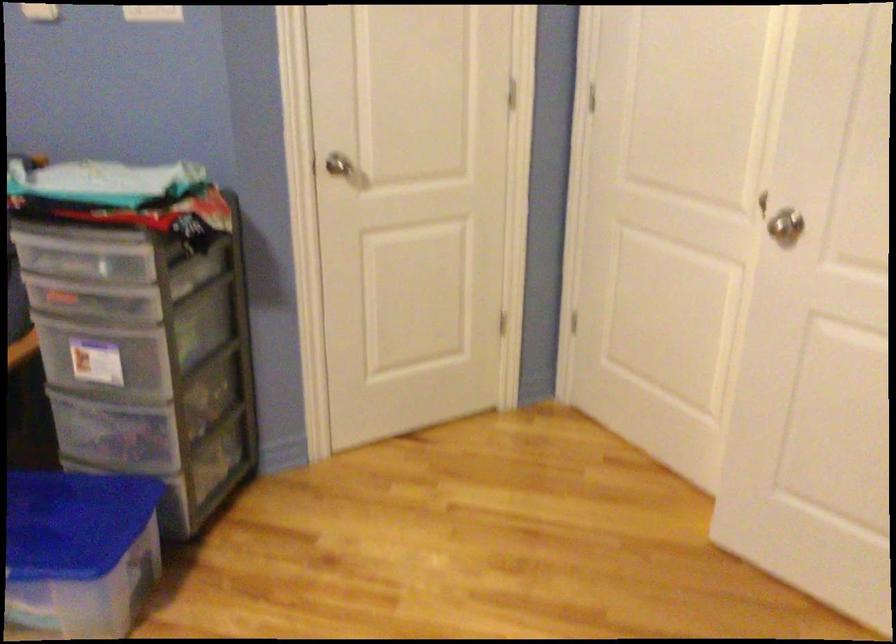
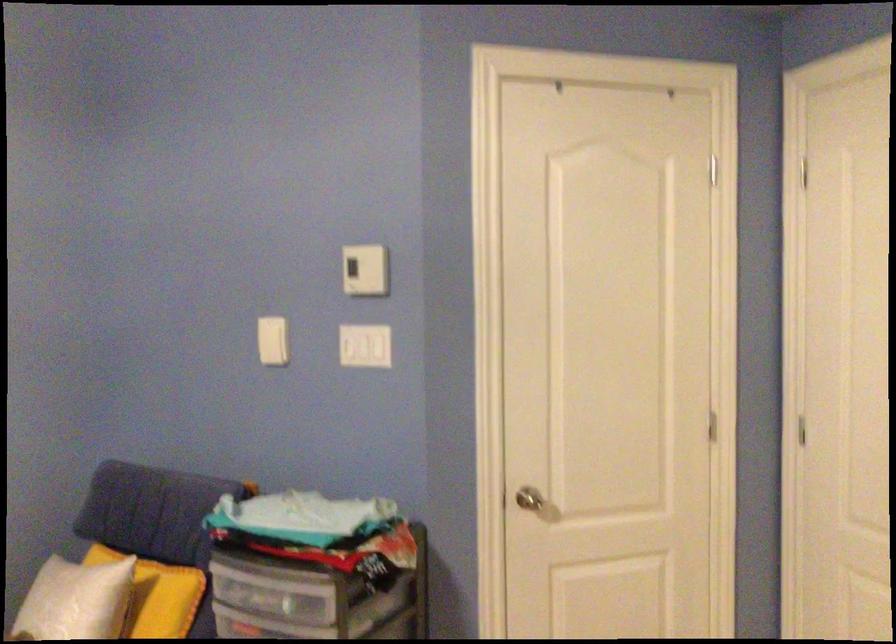
Find the pixel in the second image that matches the point at 339,173 in the first image.

(531, 502)